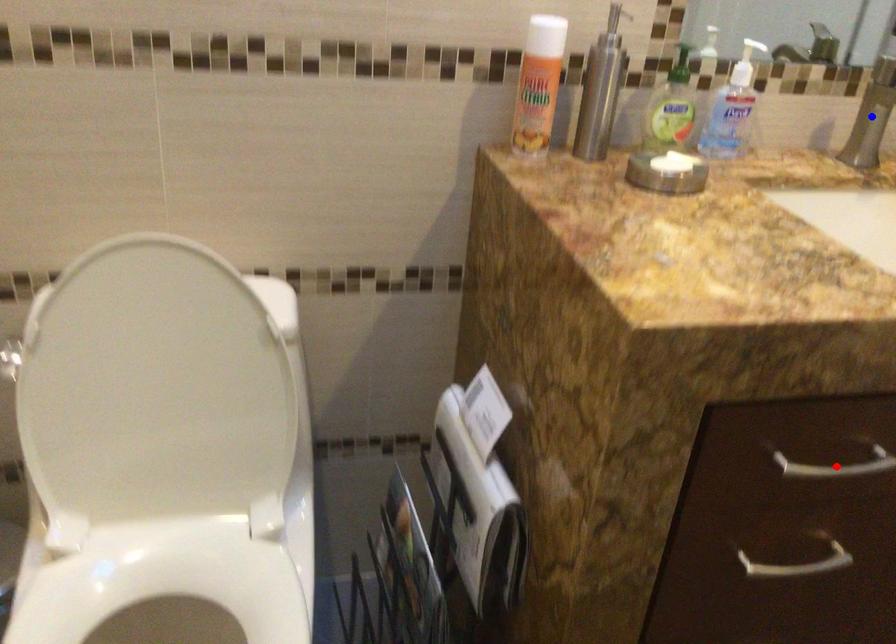
Question: Two points are marked on the image. Which point is closer to the camera?

Choices:
 (A) Blue point is closer.
 (B) Red point is closer.

Answer: (B)